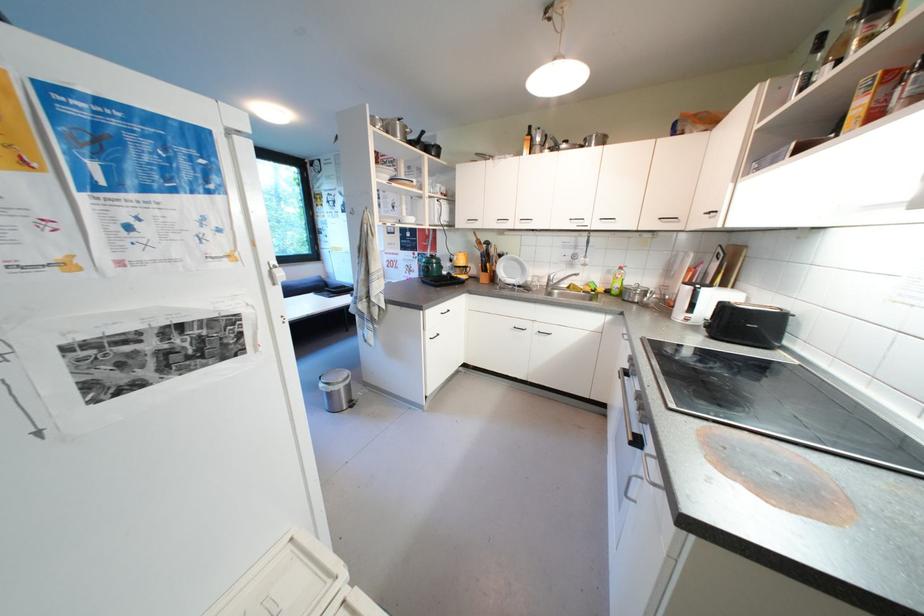
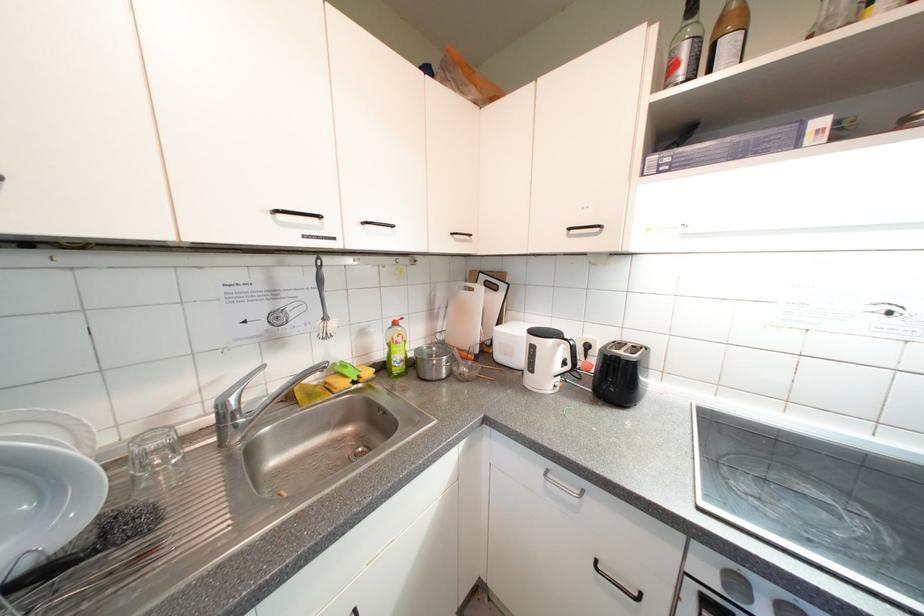
Locate, in the second image, the point that corresponds to (x=543, y=281) in the first image.

(162, 447)